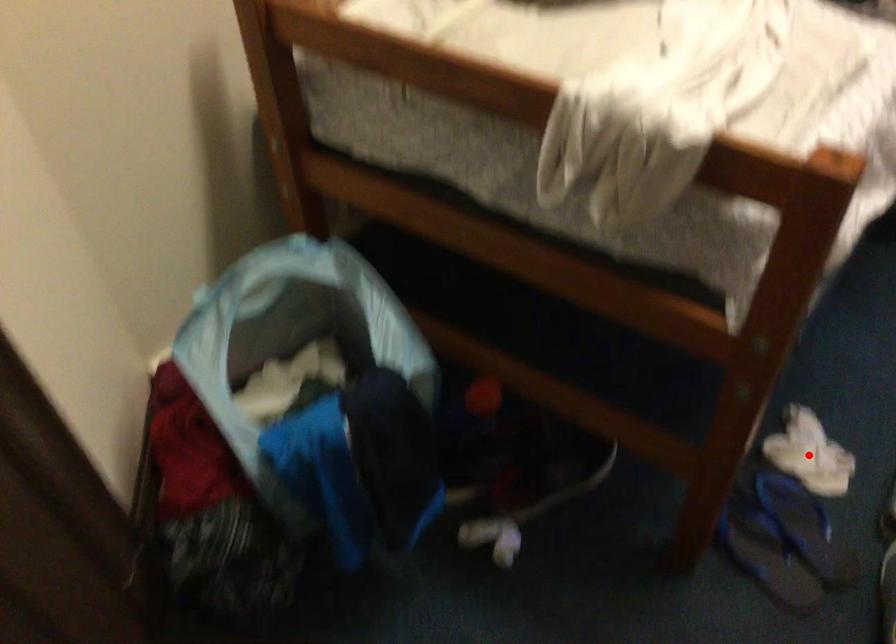
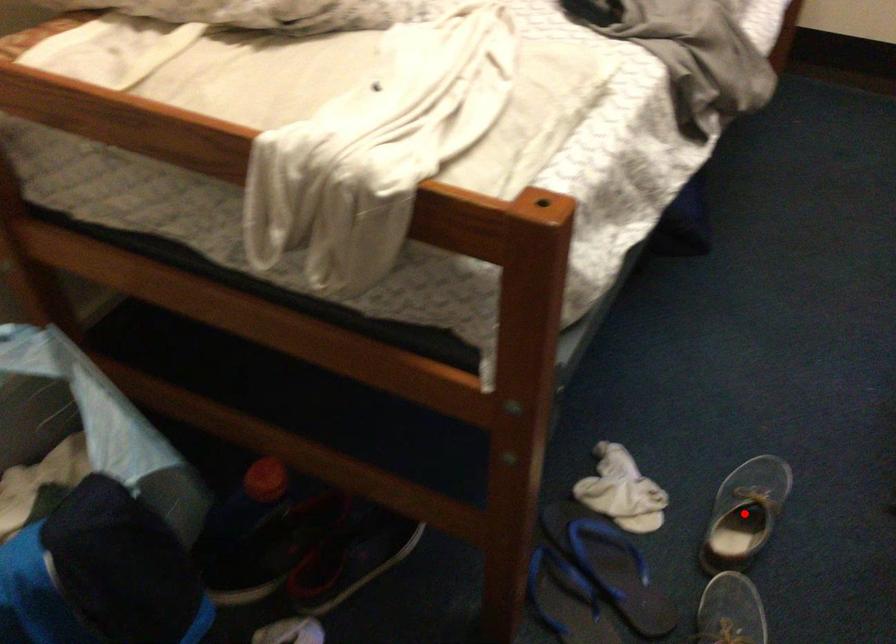
I am providing you with two images of the same scene from different viewpoints. A red point is marked on the first image and another point is marked on the second image. Are the points marked in image1 and image2 representing the same 3D position?

No